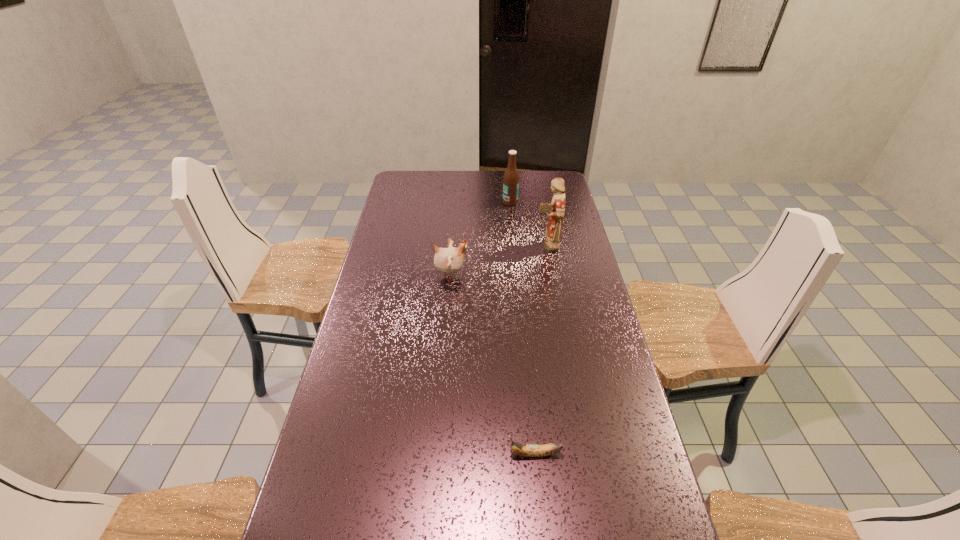
Where is `free space located on the front-facing side of the figurine`? This screenshot has width=960, height=540. free space located on the front-facing side of the figurine is located at coordinates (465, 246).

The image size is (960, 540). I want to click on vacant space located 0.320m on the left of the farthest object, so click(432, 202).

At what (x,y) coordinates should I click in order to perform the action: click on vacant region located 0.310m at the beak of the third farthest object. Please return your answer as a coordinate pair (x, y). Looking at the image, I should click on (554, 275).

Locate an element on the screen. vacant space located on the peel of the nearest object is located at coordinates (424, 454).

At what (x,y) coordinates should I click in order to perform the action: click on vacant region located 0.270m on the peel of the nearest object. Please return your answer as a coordinate pair (x, y). The image size is (960, 540). Looking at the image, I should click on (400, 454).

The width and height of the screenshot is (960, 540). I want to click on free point located 0.050m on the peel of the nearest object, so click(x=488, y=454).

Locate an element on the screen. The width and height of the screenshot is (960, 540). object present at the right edge is located at coordinates (555, 211).

In the image, there is a desktop. At what (x,y) coordinates should I click in order to perform the action: click on free space at the far edge. Please return your answer as a coordinate pair (x, y). The height and width of the screenshot is (540, 960). Looking at the image, I should click on (501, 187).

In the image, there is a desktop. At what (x,y) coordinates should I click in order to perform the action: click on vacant space at the left edge. Please return your answer as a coordinate pair (x, y). This screenshot has width=960, height=540. Looking at the image, I should click on (410, 272).

In the image, there is a desktop. Identify the location of blank space at the right edge. (586, 342).